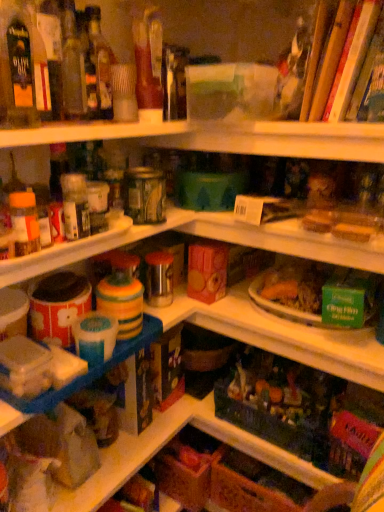
Question: Does wooden sticks at upper right lie behind translucent glass bottle at upper left, the 2th bottle in the left-to-right sequence?

Choices:
 (A) yes
 (B) no

Answer: (B)

Question: Can you confirm if wooden sticks at upper right is wider than translucent glass bottle at upper left, the 2th bottle in the left-to-right sequence?

Choices:
 (A) yes
 (B) no

Answer: (A)

Question: Can you confirm if wooden sticks at upper right is bigger than translucent glass bottle at upper left, which ranks as the second bottle in front-to-back order?

Choices:
 (A) yes
 (B) no

Answer: (A)

Question: Is wooden sticks at upper right not within translucent glass bottle at upper left, placed as the 1th bottle when sorted from right to left?

Choices:
 (A) no
 (B) yes

Answer: (B)

Question: Is translucent glass bottle at upper left, positioned as the first bottle in back-to-front order, a part of wooden sticks at upper right?

Choices:
 (A) yes
 (B) no

Answer: (B)

Question: In terms of height, does wooden sticks at upper right look taller or shorter compared to translucent glass bottle at upper left, which ranks as the second bottle in front-to-back order?

Choices:
 (A) short
 (B) tall

Answer: (A)

Question: Is wooden sticks at upper right wider or thinner than translucent glass bottle at upper left, positioned as the first bottle in back-to-front order?

Choices:
 (A) thin
 (B) wide

Answer: (B)

Question: Relative to translucent glass bottle at upper left, positioned as the first bottle in back-to-front order, is wooden sticks at upper right in front or behind?

Choices:
 (A) behind
 (B) front

Answer: (B)

Question: Considering the relative positions of wooden sticks at upper right and translucent glass bottle at upper left, positioned as the first bottle in back-to-front order, in the image provided, is wooden sticks at upper right to the left or to the right of translucent glass bottle at upper left, positioned as the first bottle in back-to-front order,?

Choices:
 (A) right
 (B) left

Answer: (A)

Question: From a real-world perspective, is translucent glass bottle at upper left, positioned as the first bottle in back-to-front order, physically located above or below matte glass bottle at upper left, marked as the second bottle in a back-to-front arrangement?

Choices:
 (A) below
 (B) above

Answer: (A)

Question: From the image's perspective, is translucent glass bottle at upper left, positioned as the first bottle in back-to-front order, positioned above or below matte glass bottle at upper left, the first bottle viewed from the left?

Choices:
 (A) below
 (B) above

Answer: (B)

Question: Is translucent glass bottle at upper left, which ranks as the second bottle in front-to-back order, inside the boundaries of matte glass bottle at upper left, the first bottle viewed from the left, or outside?

Choices:
 (A) inside
 (B) outside

Answer: (B)

Question: In the image, is translucent glass bottle at upper left, positioned as the first bottle in back-to-front order, positioned in front of or behind matte glass bottle at upper left, the first bottle viewed from the left?

Choices:
 (A) front
 (B) behind

Answer: (B)

Question: Considering the positions of point pos(94,71) and point pos(321,113), is point pos(94,71) closer or farther from the camera than point pos(321,113)?

Choices:
 (A) closer
 (B) farther

Answer: (A)

Question: Would you say translucent glass bottle at upper left, the 2th bottle in the left-to-right sequence, is inside or outside wooden sticks at upper right?

Choices:
 (A) outside
 (B) inside

Answer: (A)